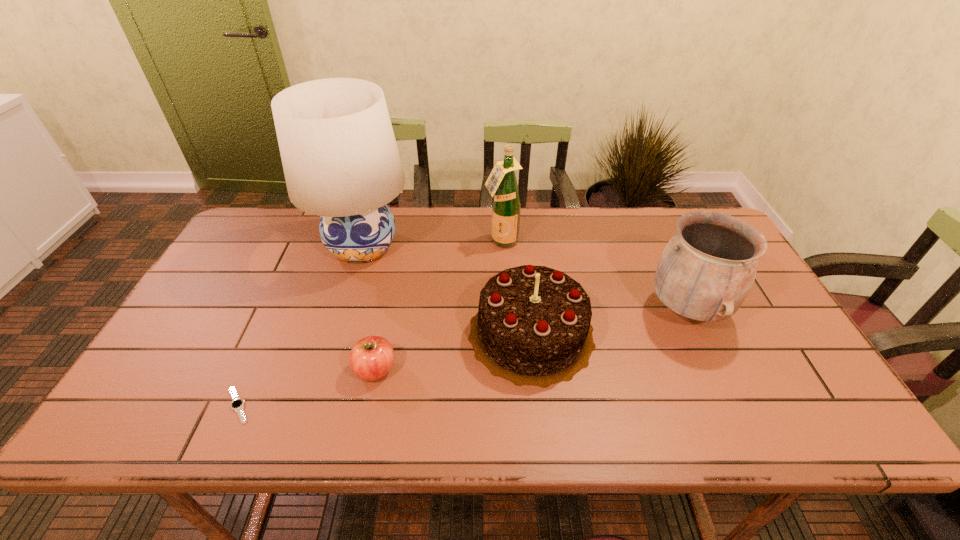
Identify the location of the tallest object. The image size is (960, 540). (340, 159).

Find the location of a particular element. This screenshot has height=540, width=960. the second tallest object is located at coordinates (502, 183).

Locate an element on the screen. This screenshot has height=540, width=960. the rightmost object is located at coordinates (706, 271).

Find the location of a particular element. This screenshot has width=960, height=540. the third tallest object is located at coordinates (706, 271).

At what (x,y) coordinates should I click in order to perform the action: click on the fourth tallest object. Please return your answer as a coordinate pair (x, y). The height and width of the screenshot is (540, 960). Looking at the image, I should click on [x=532, y=327].

This screenshot has width=960, height=540. I want to click on apple, so click(371, 358).

You are a GUI agent. You are given a task and a screenshot of the screen. Output one action in this format:
    pyautogui.click(x=<x>, y=<y>)
    Task: Click on the watch
    The width and height of the screenshot is (960, 540).
    Given the screenshot: What is the action you would take?
    pyautogui.click(x=237, y=404)

What are the coordinates of `vacant area situated 0.080m on the front-facing side of the lampshade` in the screenshot? It's located at (346, 302).

The image size is (960, 540). Identify the location of vacant area located 0.080m on the front-facing side of the liquor. (503, 268).

Where is `vacant space located 0.180m on the front of the urn`? Image resolution: width=960 pixels, height=540 pixels. vacant space located 0.180m on the front of the urn is located at coordinates (734, 412).